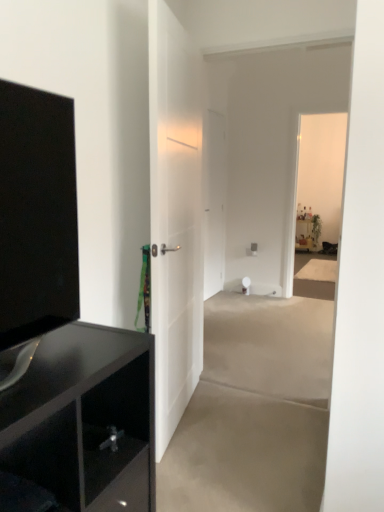
This screenshot has width=384, height=512. What are the coordinates of `smooth beige carpet at center, the 1th concrete viewed from the back` in the screenshot? It's located at (271, 343).

The image size is (384, 512). Identify the location of gray matte concrete at center, marked as the 1th concrete in a bottom-to-top arrangement. (244, 454).

Locate an element on the screen. The width and height of the screenshot is (384, 512). matte black tv at left is located at coordinates (37, 214).

Is white glossy door at center, which ranks as the 2th door in front-to-back order, facing away from white matte door at center, the 2th door when ordered from back to front?

No, white glossy door at center, which ranks as the 2th door in front-to-back order,'s orientation is not away from white matte door at center, the 2th door when ordered from back to front.

Considering the sizes of objects white glossy door at center, marked as the 2th door in a left-to-right arrangement, and white matte door at center, the 2th door when ordered from back to front, in the image provided, who is wider, white glossy door at center, marked as the 2th door in a left-to-right arrangement, or white matte door at center, the 2th door when ordered from back to front,?

Wider between the two is white matte door at center, the 2th door when ordered from back to front.

Where is `door lying on the left of white glossy door at center, which ranks as the 2th door in front-to-back order`? The width and height of the screenshot is (384, 512). door lying on the left of white glossy door at center, which ranks as the 2th door in front-to-back order is located at coordinates (175, 216).

Is gray matte concrete at center, which ranks as the 2th concrete in top-to-bottom order, positioned beyond the bounds of white glossy door at center, marked as the first door in a back-to-front arrangement?

Yes, gray matte concrete at center, which ranks as the 2th concrete in top-to-bottom order, is located beyond the bounds of white glossy door at center, marked as the first door in a back-to-front arrangement.

From a real-world perspective, is gray matte concrete at center, which ranks as the 2th concrete in top-to-bottom order, positioned above or below white glossy door at center, positioned as the 1th door in right-to-left order?

gray matte concrete at center, which ranks as the 2th concrete in top-to-bottom order, is situated lower than white glossy door at center, positioned as the 1th door in right-to-left order, in the real world.

Can you see gray matte concrete at center, positioned as the 2th concrete in back-to-front order, touching white glossy door at center, positioned as the 1th door in right-to-left order?

gray matte concrete at center, positioned as the 2th concrete in back-to-front order, and white glossy door at center, positioned as the 1th door in right-to-left order, are clearly separated.

Does point (271, 441) appear closer or farther from the camera than point (217, 170)?

Clearly, point (271, 441) is closer to the camera than point (217, 170).

Considering the positions of objects white glossy door at center, marked as the 2th door in a left-to-right arrangement, and glossy black cabinet at left in the image provided, who is in front, white glossy door at center, marked as the 2th door in a left-to-right arrangement, or glossy black cabinet at left?

Positioned in front is glossy black cabinet at left.

From a real-world perspective, relative to glossy black cabinet at left, is white glossy door at center, which ranks as the 2th door in front-to-back order, vertically above or below?

white glossy door at center, which ranks as the 2th door in front-to-back order, is situated higher than glossy black cabinet at left in the real world.

Is white glossy door at center, marked as the first door in a back-to-front arrangement, next to glossy black cabinet at left and touching it?

There is a gap between white glossy door at center, marked as the first door in a back-to-front arrangement, and glossy black cabinet at left.

Considering the positions of objects white glossy door at center, which ranks as the 2th door in front-to-back order, and gray matte concrete at center, which ranks as the 2th concrete in top-to-bottom order, in the image provided, who is more to the right, white glossy door at center, which ranks as the 2th door in front-to-back order, or gray matte concrete at center, which ranks as the 2th concrete in top-to-bottom order,?

white glossy door at center, which ranks as the 2th door in front-to-back order.

From a real-world perspective, which object rests below the other?

gray matte concrete at center, placed as the first concrete when sorted from front to back.

What's the angular difference between white glossy door at center, marked as the 2th door in a left-to-right arrangement, and gray matte concrete at center, which ranks as the 2th concrete in top-to-bottom order,'s facing directions?

89.4 degrees.

Who is more distant, white glossy door at center, marked as the 2th door in a left-to-right arrangement, or gray matte concrete at center, which ranks as the 2th concrete in top-to-bottom order?

Positioned behind is white glossy door at center, marked as the 2th door in a left-to-right arrangement.

The width and height of the screenshot is (384, 512). Identify the location of toilet paper below the white glossy door at center, marked as the first door in a back-to-front arrangement (from the image's perspective). (246, 285).

Considering the sizes of white glossy door at center, marked as the first door in a back-to-front arrangement, and white matte toilet paper at center in the image, is white glossy door at center, marked as the first door in a back-to-front arrangement, taller or shorter than white matte toilet paper at center?

→ Considering their sizes, white glossy door at center, marked as the first door in a back-to-front arrangement, has more height than white matte toilet paper at center.

Considering the positions of points (216, 252) and (242, 286), is point (216, 252) farther from camera compared to point (242, 286)?

Yes, it is.

Is white glossy door at center, marked as the first door in a back-to-front arrangement, beside white matte toilet paper at center?

white glossy door at center, marked as the first door in a back-to-front arrangement, is not next to white matte toilet paper at center, and they're not touching.

Is matte black tv at left spatially inside gray matte concrete at center, which ranks as the 2th concrete in top-to-bottom order, or outside of it?

matte black tv at left is not enclosed by gray matte concrete at center, which ranks as the 2th concrete in top-to-bottom order.

Does matte black tv at left have a lesser width compared to gray matte concrete at center, positioned as the 2th concrete in back-to-front order?

Yes, matte black tv at left is thinner than gray matte concrete at center, positioned as the 2th concrete in back-to-front order.

Is point (75, 173) farther from viewer compared to point (238, 432)?

No, it is not.

From the picture: Is matte black tv at left with gray matte concrete at center, placed as the first concrete when sorted from front to back?

They are not placed beside each other.

How different are the orientations of gray matte concrete at center, marked as the 1th concrete in a bottom-to-top arrangement, and white matte toilet paper at center in degrees?

0.888 degrees separate the facing orientations of gray matte concrete at center, marked as the 1th concrete in a bottom-to-top arrangement, and white matte toilet paper at center.

Visually, is gray matte concrete at center, which ranks as the 2th concrete in top-to-bottom order, positioned to the left or to the right of white matte toilet paper at center?

gray matte concrete at center, which ranks as the 2th concrete in top-to-bottom order, is to the left of white matte toilet paper at center.

Are gray matte concrete at center, marked as the 1th concrete in a bottom-to-top arrangement, and white matte toilet paper at center beside each other?

gray matte concrete at center, marked as the 1th concrete in a bottom-to-top arrangement, is not next to white matte toilet paper at center, and they're not touching.

There is a white matte toilet paper at center. Where is `the 2nd concrete below it (from the image's perspective)`? The width and height of the screenshot is (384, 512). the 2nd concrete below it (from the image's perspective) is located at coordinates (244, 454).

You are a GUI agent. You are given a task and a screenshot of the screen. Output one action in this format:
    pyautogui.click(x=<x>, y=<y>)
    Task: Click on the door below the white glossy door at center, marked as the first door in a back-to-front arrangement (from the image's perspective)
    
    Given the screenshot: What is the action you would take?
    pyautogui.click(x=175, y=216)

Locate an element on the screen. The image size is (384, 512). the 2nd door behind the gray matte concrete at center, marked as the 1th concrete in a bottom-to-top arrangement is located at coordinates (214, 202).

Based on their spatial positions, is glossy black cabinet at left or white glossy door at center, marked as the first door in a back-to-front arrangement, further from smooth beige carpet at center, the 1th concrete viewed from the back?

glossy black cabinet at left.

Considering their positions, is white glossy door at center, marked as the first door in a back-to-front arrangement, positioned further to glossy black cabinet at left than white matte toilet paper at center?

The object further to glossy black cabinet at left is white matte toilet paper at center.

Considering their positions, is white glossy door at center, marked as the 2th door in a left-to-right arrangement, positioned further to smooth beige carpet at center, the second concrete from the front, than white matte toilet paper at center?

white matte toilet paper at center is positioned further to the anchor smooth beige carpet at center, the second concrete from the front.

Looking at the image, which one is located further to white glossy door at center, positioned as the 1th door in right-to-left order, gray matte concrete at center, which ranks as the 2th concrete in top-to-bottom order, or glossy black cabinet at left?

glossy black cabinet at left is positioned further to the anchor white glossy door at center, positioned as the 1th door in right-to-left order.

Which object lies nearer to the anchor point white glossy door at center, which ranks as the 2th door in front-to-back order, white matte door at center, which is the first door in front-to-back order, or white matte toilet paper at center?

white matte toilet paper at center lies closer to white glossy door at center, which ranks as the 2th door in front-to-back order, than the other object.

Based on their spatial positions, is white glossy door at center, marked as the 2th door in a left-to-right arrangement, or smooth beige carpet at center, which is counted as the first concrete, starting from the top, closer to matte black tv at left?

Based on the image, smooth beige carpet at center, which is counted as the first concrete, starting from the top, appears to be nearer to matte black tv at left.

Based on their spatial positions, is white matte door at center, which is the first door in front-to-back order, or gray matte concrete at center, marked as the 1th concrete in a bottom-to-top arrangement, closer to white matte toilet paper at center?

white matte door at center, which is the first door in front-to-back order, is closer to white matte toilet paper at center.

Considering their positions, is glossy black cabinet at left positioned further to smooth beige carpet at center, which is counted as the first concrete, starting from the top, than white matte toilet paper at center?

The object further to smooth beige carpet at center, which is counted as the first concrete, starting from the top, is glossy black cabinet at left.

Identify the location of door positioned between gray matte concrete at center, positioned as the 2th concrete in back-to-front order, and white glossy door at center, marked as the 2th door in a left-to-right arrangement, from near to far. (175, 216).

At what (x,y) coordinates should I click in order to perform the action: click on door between glossy black cabinet at left and smooth beige carpet at center, which is counted as the first concrete, starting from the top, from front to back. Please return your answer as a coordinate pair (x, y). Looking at the image, I should click on (175, 216).

The image size is (384, 512). In order to click on door between smooth beige carpet at center, the 1th concrete viewed from the back, and white matte toilet paper at center, along the z-axis in this screenshot , I will do `click(214, 202)`.

Identify the location of concrete located between white matte door at center, which is the 1th door in left-to-right order, and white matte toilet paper at center in the depth direction. The width and height of the screenshot is (384, 512). (271, 343).